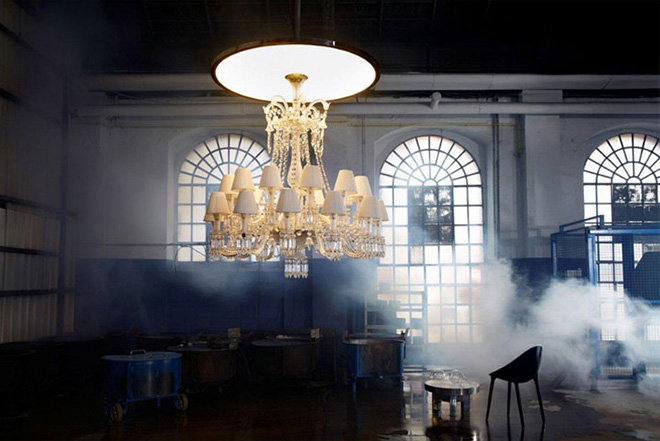
Identify the location of light. (627, 153).